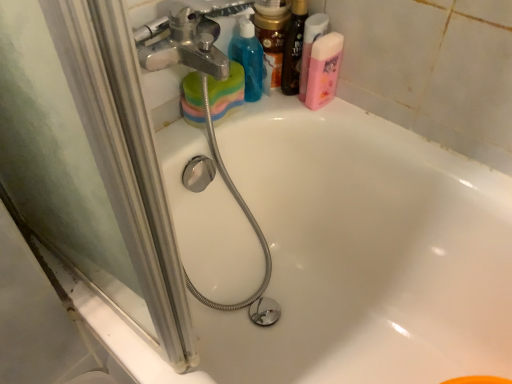
Find the location of a particular element. The height and width of the screenshot is (384, 512). white glossy bathtub at upper center is located at coordinates (364, 252).

What do you see at coordinates (310, 46) in the screenshot?
I see `pink matte shaving cream at upper right` at bounding box center [310, 46].

Find the location of `shiny gold jar at upper center, acting as the 2th toiletry starting from the right`. shiny gold jar at upper center, acting as the 2th toiletry starting from the right is located at coordinates (272, 36).

The width and height of the screenshot is (512, 384). In order to click on cleaning product on the right of the pink matte shaving cream at upper right in this screenshot , I will do 323,70.

Can you confirm if pink matte bottle at upper right, arranged as the 1th cleaning product when viewed from the right, is taller than pink matte shaving cream at upper right?

No, pink matte bottle at upper right, arranged as the 1th cleaning product when viewed from the right, is not taller than pink matte shaving cream at upper right.

Between pink matte bottle at upper right, arranged as the 1th cleaning product when viewed from the right, and pink matte shaving cream at upper right, which one has larger width?

pink matte bottle at upper right, arranged as the 1th cleaning product when viewed from the right.

Considering the sizes of objects translucent blue plastic bottle at upper center, positioned as the 2th cleaning product in right-to-left order, and shiny black bottle at upper right, which is the second toiletry in left-to-right order, in the image provided, who is smaller, translucent blue plastic bottle at upper center, positioned as the 2th cleaning product in right-to-left order, or shiny black bottle at upper right, which is the second toiletry in left-to-right order,?

With smaller size is shiny black bottle at upper right, which is the second toiletry in left-to-right order.

From a real-world perspective, is translucent blue plastic bottle at upper center, positioned as the 2th cleaning product in right-to-left order, physically above shiny black bottle at upper right, the 1th toiletry in the right-to-left sequence?

No, from a real-world perspective, translucent blue plastic bottle at upper center, positioned as the 2th cleaning product in right-to-left order, is not over shiny black bottle at upper right, the 1th toiletry in the right-to-left sequence

Is translucent blue plastic bottle at upper center, arranged as the first cleaning product when viewed from the left, looking in the opposite direction of shiny black bottle at upper right, the 1th toiletry in the right-to-left sequence?

No, translucent blue plastic bottle at upper center, arranged as the first cleaning product when viewed from the left, is not facing away from shiny black bottle at upper right, the 1th toiletry in the right-to-left sequence.

Is point (260, 62) more distant than point (305, 15)?

Yes, it is.

Where is `toiletry that appears behind the pink matte bottle at upper right, arranged as the 1th cleaning product when viewed from the right`? toiletry that appears behind the pink matte bottle at upper right, arranged as the 1th cleaning product when viewed from the right is located at coordinates (272, 36).

Considering the positions of point (265, 90) and point (324, 38), is point (265, 90) closer or farther from the camera than point (324, 38)?

Point (265, 90).

Does shiny gold jar at upper center, which ranks as the first toiletry in left-to-right order, appear on the left side of pink matte bottle at upper right, arranged as the 1th cleaning product when viewed from the right?

Correct, you'll find shiny gold jar at upper center, which ranks as the first toiletry in left-to-right order, to the left of pink matte bottle at upper right, arranged as the 1th cleaning product when viewed from the right.

Is point (323, 17) closer or farther from the camera than point (275, 82)?

Point (323, 17).

Is shiny gold jar at upper center, which ranks as the first toiletry in left-to-right order, a part of pink matte shaving cream at upper right?

No, shiny gold jar at upper center, which ranks as the first toiletry in left-to-right order, is not a part of pink matte shaving cream at upper right.

Considering the sizes of objects pink matte shaving cream at upper right and shiny gold jar at upper center, acting as the 2th toiletry starting from the right, in the image provided, who is thinner, pink matte shaving cream at upper right or shiny gold jar at upper center, acting as the 2th toiletry starting from the right,?

Thinner between the two is shiny gold jar at upper center, acting as the 2th toiletry starting from the right.

Considering the relative sizes of white glossy bathtub at upper center and shiny black bottle at upper right, the 1th toiletry in the right-to-left sequence, in the image provided, is white glossy bathtub at upper center wider than shiny black bottle at upper right, the 1th toiletry in the right-to-left sequence,?

Yes, white glossy bathtub at upper center is wider than shiny black bottle at upper right, the 1th toiletry in the right-to-left sequence.

From the image's perspective, is white glossy bathtub at upper center on top of shiny black bottle at upper right, the 1th toiletry in the right-to-left sequence?

No, from the image's perspective, white glossy bathtub at upper center is not above shiny black bottle at upper right, the 1th toiletry in the right-to-left sequence.

Starting from the white glossy bathtub at upper center, which toiletry is the 1st one behind? Please provide its 2D coordinates.

[(293, 48)]

Is white glossy bathtub at upper center facing towards shiny black bottle at upper right, which is the second toiletry in left-to-right order?

No, white glossy bathtub at upper center is not aimed at shiny black bottle at upper right, which is the second toiletry in left-to-right order.

Between pink matte bottle at upper right, which appears as the second cleaning product when viewed from the left, and shiny gold jar at upper center, acting as the 2th toiletry starting from the right, which one has larger width?

pink matte bottle at upper right, which appears as the second cleaning product when viewed from the left.

How many degrees apart are the facing directions of pink matte bottle at upper right, arranged as the 1th cleaning product when viewed from the right, and shiny gold jar at upper center, which ranks as the first toiletry in left-to-right order?

pink matte bottle at upper right, arranged as the 1th cleaning product when viewed from the right, and shiny gold jar at upper center, which ranks as the first toiletry in left-to-right order, are facing 3.06 degrees away from each other.

In terms of height, does pink matte bottle at upper right, which appears as the second cleaning product when viewed from the left, look taller or shorter compared to shiny gold jar at upper center, which ranks as the first toiletry in left-to-right order?

Considering their sizes, pink matte bottle at upper right, which appears as the second cleaning product when viewed from the left, has less height than shiny gold jar at upper center, which ranks as the first toiletry in left-to-right order.

From a real-world perspective, is shiny black bottle at upper right, which is the second toiletry in left-to-right order, over white glossy bathtub at upper center?

Correct, in the physical world, shiny black bottle at upper right, which is the second toiletry in left-to-right order, is higher than white glossy bathtub at upper center.

Is shiny black bottle at upper right, which is the second toiletry in left-to-right order, next to white glossy bathtub at upper center and touching it?

No.

Is shiny black bottle at upper right, which is the second toiletry in left-to-right order, oriented towards white glossy bathtub at upper center?

No, shiny black bottle at upper right, which is the second toiletry in left-to-right order, is not facing towards white glossy bathtub at upper center.

Considering the sizes of objects shiny black bottle at upper right, which is the second toiletry in left-to-right order, and white glossy bathtub at upper center in the image provided, who is bigger, shiny black bottle at upper right, which is the second toiletry in left-to-right order, or white glossy bathtub at upper center?

white glossy bathtub at upper center is bigger.

From a real-world perspective, starting from the pink matte shaving cream at upper right, which cleaning product is the 1st one below it? Please provide its 2D coordinates.

[(323, 70)]

Identify the location of the 2nd toiletry in front when counting from the translucent blue plastic bottle at upper center, positioned as the 2th cleaning product in right-to-left order. This screenshot has width=512, height=384. (293, 48).

From the image, which object appears to be farther from pink matte shaving cream at upper right, pink matte bottle at upper right, which appears as the second cleaning product when viewed from the left, or white glossy bathtub at upper center?

white glossy bathtub at upper center is positioned further to the anchor pink matte shaving cream at upper right.

Looking at this image, when comparing their distances from pink matte bottle at upper right, arranged as the 1th cleaning product when viewed from the right, does translucent blue plastic bottle at upper center, positioned as the 2th cleaning product in right-to-left order, or pink matte shaving cream at upper right seem further?

translucent blue plastic bottle at upper center, positioned as the 2th cleaning product in right-to-left order, is positioned further to the anchor pink matte bottle at upper right, arranged as the 1th cleaning product when viewed from the right.

Based on their spatial positions, is white glossy bathtub at upper center or shiny gold jar at upper center, acting as the 2th toiletry starting from the right, further from pink matte shaving cream at upper right?

white glossy bathtub at upper center lies further to pink matte shaving cream at upper right than the other object.

Which object lies further to the anchor point pink matte shaving cream at upper right, translucent blue plastic bottle at upper center, arranged as the first cleaning product when viewed from the left, or shiny black bottle at upper right, the 1th toiletry in the right-to-left sequence?

Among the two, translucent blue plastic bottle at upper center, arranged as the first cleaning product when viewed from the left, is located further to pink matte shaving cream at upper right.

Looking at the image, which one is located further to shiny gold jar at upper center, acting as the 2th toiletry starting from the right, translucent blue plastic bottle at upper center, positioned as the 2th cleaning product in right-to-left order, or white glossy bathtub at upper center?

white glossy bathtub at upper center.

Estimate the real-world distances between objects in this image. Which object is closer to translucent blue plastic bottle at upper center, positioned as the 2th cleaning product in right-to-left order, white glossy bathtub at upper center or pink matte shaving cream at upper right?

pink matte shaving cream at upper right.

Based on their spatial positions, is white glossy bathtub at upper center or shiny gold jar at upper center, which ranks as the first toiletry in left-to-right order, closer to translucent blue plastic bottle at upper center, arranged as the first cleaning product when viewed from the left?

shiny gold jar at upper center, which ranks as the first toiletry in left-to-right order, lies closer to translucent blue plastic bottle at upper center, arranged as the first cleaning product when viewed from the left, than the other object.

Estimate the real-world distances between objects in this image. Which object is closer to shiny black bottle at upper right, which is the second toiletry in left-to-right order, pink matte shaving cream at upper right or pink matte bottle at upper right, which appears as the second cleaning product when viewed from the left?

pink matte shaving cream at upper right is closer to shiny black bottle at upper right, which is the second toiletry in left-to-right order.

This screenshot has height=384, width=512. I want to click on shaving cream between shiny gold jar at upper center, acting as the 2th toiletry starting from the right, and pink matte bottle at upper right, which appears as the second cleaning product when viewed from the left, vertically, so click(x=310, y=46).

You are a GUI agent. You are given a task and a screenshot of the screen. Output one action in this format:
    pyautogui.click(x=<x>, y=<y>)
    Task: Click on the shaving cream between shiny black bottle at upper right, which is the second toiletry in left-to-right order, and white glossy bathtub at upper center vertically
    This screenshot has width=512, height=384.
    Given the screenshot: What is the action you would take?
    pyautogui.click(x=310, y=46)

Locate an element on the screen. The image size is (512, 384). toiletry between shiny black bottle at upper right, the 1th toiletry in the right-to-left sequence, and translucent blue plastic bottle at upper center, positioned as the 2th cleaning product in right-to-left order, along the z-axis is located at coordinates (272, 36).

At what (x,y) coordinates should I click in order to perform the action: click on shaving cream that lies between shiny gold jar at upper center, acting as the 2th toiletry starting from the right, and white glossy bathtub at upper center from top to bottom. Please return your answer as a coordinate pair (x, y). Looking at the image, I should click on (310, 46).